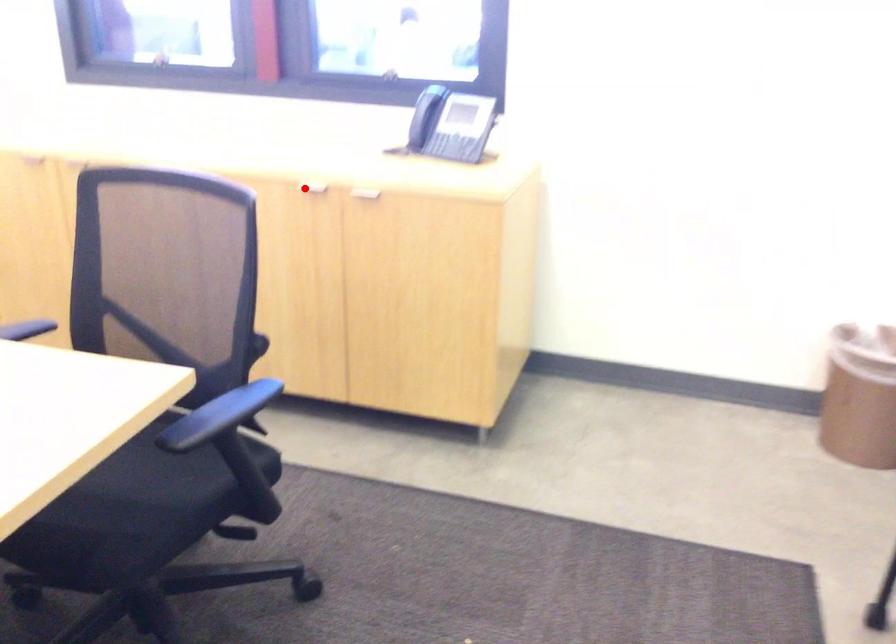
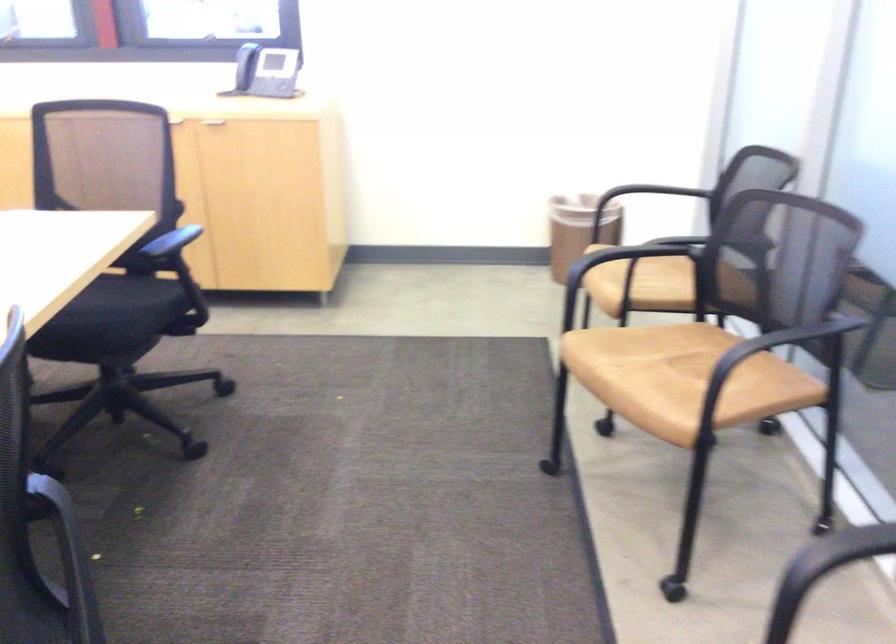
Question: I am providing you with two images of the same scene from different viewpoints. A red point is marked on the first image. Can you still see the location of the red point in image 2?

Choices:
 (A) Yes
 (B) No

Answer: (B)